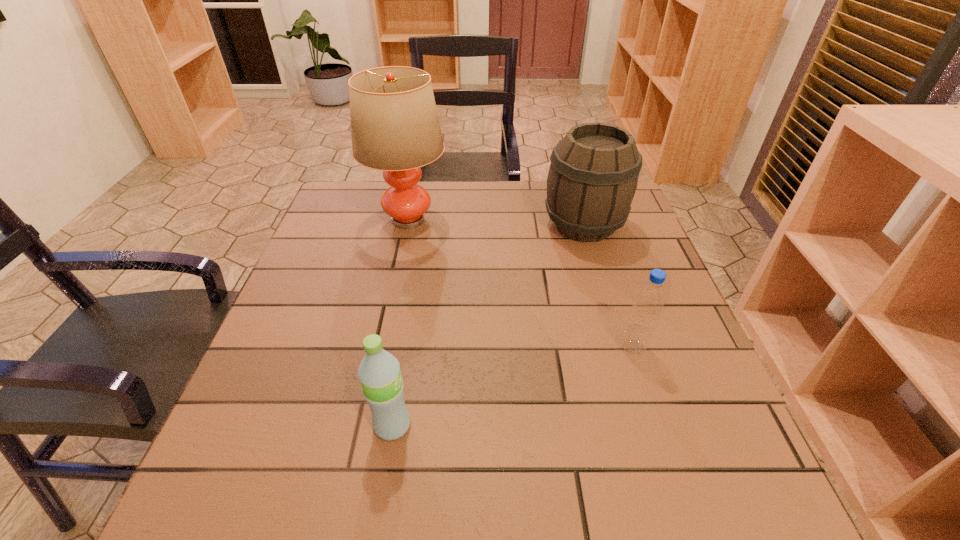
What are the coordinates of `lamp located in the far edge section of the desktop` in the screenshot? It's located at (395, 128).

The height and width of the screenshot is (540, 960). Identify the location of wine bucket at the far edge. (593, 176).

The image size is (960, 540). What are the coordinates of `object that is at the left edge` in the screenshot? It's located at (395, 128).

Find the location of a particular element. wine bucket that is at the right edge is located at coordinates tap(593, 176).

This screenshot has height=540, width=960. In order to click on water bottle at the right edge in this screenshot , I will do `click(649, 300)`.

You are a GUI agent. You are given a task and a screenshot of the screen. Output one action in this format:
    pyautogui.click(x=<x>, y=<y>)
    Task: Click on the object at the far left corner
    
    Given the screenshot: What is the action you would take?
    pyautogui.click(x=395, y=128)

The width and height of the screenshot is (960, 540). Identify the location of object that is at the far right corner. (593, 176).

The height and width of the screenshot is (540, 960). Identify the location of vacant area at the far edge of the desktop. (530, 194).

Identify the location of free region at the near edge of the desktop. The width and height of the screenshot is (960, 540). (447, 473).

The width and height of the screenshot is (960, 540). In order to click on vacant region at the left edge of the desktop in this screenshot , I will do `click(296, 289)`.